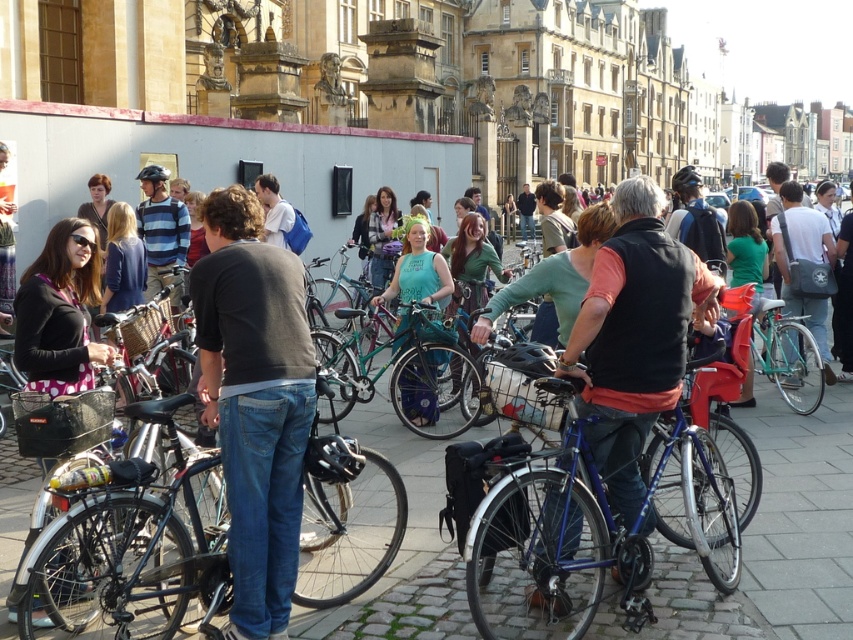
Between dark gray cotton shirt at center and green matte bicycle at center, which one is positioned higher?

green matte bicycle at center

Does dark gray cotton shirt at center appear over green matte bicycle at center?

No, dark gray cotton shirt at center is not above green matte bicycle at center.

The image size is (853, 640). Find the location of `dark gray cotton shirt at center`. dark gray cotton shirt at center is located at coordinates (254, 401).

This screenshot has height=640, width=853. I want to click on dark gray cotton shirt at center, so click(x=254, y=401).

Can you confirm if blue metallic bicycle at center is taller than teal matte bicycle at center?

Correct, blue metallic bicycle at center is much taller as teal matte bicycle at center.

Describe the element at coordinates (634, 339) in the screenshot. This screenshot has width=853, height=640. I see `blue metallic bicycle at center` at that location.

Where is `blue metallic bicycle at center`? Image resolution: width=853 pixels, height=640 pixels. blue metallic bicycle at center is located at coordinates pyautogui.click(x=634, y=339).

Is shiny blue frame at center to the left of teal matte bicycle at center from the viewer's perspective?

No, shiny blue frame at center is not to the left of teal matte bicycle at center.

How far apart are shiny blue frame at center and teal matte bicycle at center?

shiny blue frame at center and teal matte bicycle at center are 14.15 meters apart from each other.

Is point (728, 561) farther from camera compared to point (364, 364)?

That is False.

Find the location of a particular element. shiny blue frame at center is located at coordinates (552, 544).